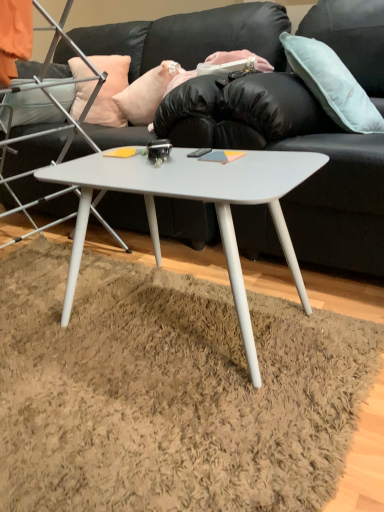
You are a GUI agent. You are given a task and a screenshot of the screen. Output one action in this format:
    pyautogui.click(x=<x>, y=<y>)
    Task: Click on the white matte chair at center
    The width and height of the screenshot is (384, 512).
    Given the screenshot: What is the action you would take?
    pyautogui.click(x=51, y=128)

What is the approximate width of white matte chair at center?

27.33 inches.

Describe the element at coordinates (264, 124) in the screenshot. The width and height of the screenshot is (384, 512). I see `black leather couch at center` at that location.

This screenshot has height=512, width=384. I want to click on pink fabric pillow at upper center, the second pillow when ordered from right to left, so click(146, 93).

In order to face peach fabric pillow at upper left, the 1th pillow in the left-to-right sequence, should I rotate leftwards or rightwards?

You should rotate left by 11.701 degrees.

The width and height of the screenshot is (384, 512). I want to click on peach fabric pillow at upper left, arranged as the third pillow when viewed from the right, so click(x=109, y=90).

This screenshot has width=384, height=512. Identify the location of white matte chair at center. (51, 128).

Can you confirm if black leather couch at center is taller than light blue fabric pillow at upper right, which is counted as the 3th pillow, starting from the left?

Indeed, black leather couch at center has a greater height compared to light blue fabric pillow at upper right, which is counted as the 3th pillow, starting from the left.

Find the location of a particular element. pillow that is the 3rd one above the black leather couch at center (from a real-world perspective) is located at coordinates (332, 84).

Does black leather couch at center touch light blue fabric pillow at upper right, the first pillow when ordered from right to left?

No, black leather couch at center is not next to light blue fabric pillow at upper right, the first pillow when ordered from right to left.

In the image, there is a pink fabric pillow at upper center, acting as the 2th pillow starting from the left. Where is `pillow above it (from the image's perspective)`? This screenshot has height=512, width=384. pillow above it (from the image's perspective) is located at coordinates (109, 90).

In the scene shown: Is peach fabric pillow at upper left, arranged as the third pillow when viewed from the right, further to camera compared to pink fabric pillow at upper center, the second pillow when ordered from right to left?

Yes, peach fabric pillow at upper left, arranged as the third pillow when viewed from the right, is further from the viewer.

Would you say pink fabric pillow at upper center, acting as the 2th pillow starting from the left, is part of peach fabric pillow at upper left, the 1th pillow in the left-to-right sequence,'s contents?

No, pink fabric pillow at upper center, acting as the 2th pillow starting from the left, is not a part of peach fabric pillow at upper left, the 1th pillow in the left-to-right sequence.

Is point (113, 82) positioned in front of point (165, 77)?

No, it is behind (165, 77).

What's the angular difference between peach fabric pillow at upper left, the 1th pillow in the left-to-right sequence, and white matte chair at center's facing directions?

The angle between the facing direction of peach fabric pillow at upper left, the 1th pillow in the left-to-right sequence, and the facing direction of white matte chair at center is 18.3 degrees.

From a real-world perspective, is peach fabric pillow at upper left, arranged as the third pillow when viewed from the right, under white matte chair at center?

No, from a real-world perspective, peach fabric pillow at upper left, arranged as the third pillow when viewed from the right, is not under white matte chair at center.

Considering the sizes of objects peach fabric pillow at upper left, arranged as the third pillow when viewed from the right, and white matte chair at center in the image provided, who is taller, peach fabric pillow at upper left, arranged as the third pillow when viewed from the right, or white matte chair at center?

white matte chair at center is taller.

Is peach fabric pillow at upper left, the 1th pillow in the left-to-right sequence, at the right side of white matte chair at center?

Yes, peach fabric pillow at upper left, the 1th pillow in the left-to-right sequence, is to the right of white matte chair at center.

Which object is thinner, white matte chair at center or peach fabric pillow at upper left, arranged as the third pillow when viewed from the right?

peach fabric pillow at upper left, arranged as the third pillow when viewed from the right.

Which object is positioned more to the right, white matte chair at center or peach fabric pillow at upper left, the 1th pillow in the left-to-right sequence?

From the viewer's perspective, peach fabric pillow at upper left, the 1th pillow in the left-to-right sequence, appears more on the right side.

From a real-world perspective, which object stands above the other?

peach fabric pillow at upper left, arranged as the third pillow when viewed from the right, from a real-world perspective.

What's the angular difference between white matte chair at center and peach fabric pillow at upper left, arranged as the third pillow when viewed from the right,'s facing directions?

white matte chair at center and peach fabric pillow at upper left, arranged as the third pillow when viewed from the right, are facing 18.3 degrees away from each other.

From a real-world perspective, is peach fabric pillow at upper left, arranged as the third pillow when viewed from the right, located higher than light blue fabric pillow at upper right, the first pillow when ordered from right to left?

No, from a real-world perspective, peach fabric pillow at upper left, arranged as the third pillow when viewed from the right, is not over light blue fabric pillow at upper right, the first pillow when ordered from right to left

Is point (71, 61) farther from camera compared to point (306, 61)?

That is True.

Could you tell me if peach fabric pillow at upper left, arranged as the third pillow when viewed from the right, is turned towards light blue fabric pillow at upper right, the first pillow when ordered from right to left?

No, peach fabric pillow at upper left, arranged as the third pillow when viewed from the right, is not turned towards light blue fabric pillow at upper right, the first pillow when ordered from right to left.

From the image's perspective, who appears lower, white matte coffee table at center or light blue fabric pillow at upper right, which is counted as the 3th pillow, starting from the left?

From the image's view, white matte coffee table at center is below.

Based on the photo, which object is positioned more to the left, white matte coffee table at center or light blue fabric pillow at upper right, which is counted as the 3th pillow, starting from the left?

white matte coffee table at center.

Does white matte coffee table at center have a larger size compared to light blue fabric pillow at upper right, which is counted as the 3th pillow, starting from the left?

Indeed, white matte coffee table at center has a larger size compared to light blue fabric pillow at upper right, which is counted as the 3th pillow, starting from the left.

From the image's perspective, count 1st pillows upward from the white matte coffee table at center and point to it. Please provide its 2D coordinates.

[(332, 84)]

Is white matte chair at center oriented towards white matte coffee table at center?

No.

Who is bigger, white matte chair at center or white matte coffee table at center?

Bigger between the two is white matte chair at center.

From the image's perspective, which object appears higher, white matte chair at center or white matte coffee table at center?

white matte chair at center is shown above in the image.

From a real-world perspective, does white matte chair at center sit lower than white matte coffee table at center?

Actually, white matte chair at center is physically above white matte coffee table at center in the real world.

This screenshot has width=384, height=512. I want to click on studio couch above the light blue fabric pillow at upper right, which is counted as the 3th pillow, starting from the left (from the image's perspective), so click(x=264, y=124).

From the peach fabric pillow at upper left, arranged as the third pillow when viewed from the right, count 1st pillows forward and point to it. Please provide its 2D coordinates.

[(146, 93)]

From the image, which object appears to be nearer to pink fabric pillow at upper center, acting as the 2th pillow starting from the left, white matte chair at center or light blue fabric pillow at upper right, the first pillow when ordered from right to left?

white matte chair at center is closer to pink fabric pillow at upper center, acting as the 2th pillow starting from the left.

Based on the photo, when comparing their distances from pink fabric pillow at upper center, acting as the 2th pillow starting from the left, does light blue fabric pillow at upper right, which is counted as the 3th pillow, starting from the left, or black leather couch at center seem further?

Among the two, light blue fabric pillow at upper right, which is counted as the 3th pillow, starting from the left, is located further to pink fabric pillow at upper center, acting as the 2th pillow starting from the left.

From the image, which object appears to be farther from black leather couch at center, light blue fabric pillow at upper right, the first pillow when ordered from right to left, or peach fabric pillow at upper left, arranged as the third pillow when viewed from the right?

peach fabric pillow at upper left, arranged as the third pillow when viewed from the right, is further to black leather couch at center.

Estimate the real-world distances between objects in this image. Which object is closer to white matte coffee table at center, white matte chair at center or black leather couch at center?

black leather couch at center.

Estimate the real-world distances between objects in this image. Which object is closer to pink fabric pillow at upper center, acting as the 2th pillow starting from the left, peach fabric pillow at upper left, the 1th pillow in the left-to-right sequence, or light blue fabric pillow at upper right, which is counted as the 3th pillow, starting from the left?

Based on the image, peach fabric pillow at upper left, the 1th pillow in the left-to-right sequence, appears to be nearer to pink fabric pillow at upper center, acting as the 2th pillow starting from the left.

Considering their positions, is black leather couch at center positioned further to peach fabric pillow at upper left, the 1th pillow in the left-to-right sequence, than light blue fabric pillow at upper right, the first pillow when ordered from right to left?

light blue fabric pillow at upper right, the first pillow when ordered from right to left, lies further to peach fabric pillow at upper left, the 1th pillow in the left-to-right sequence, than the other object.

Based on their spatial positions, is peach fabric pillow at upper left, arranged as the third pillow when viewed from the right, or light blue fabric pillow at upper right, which is counted as the 3th pillow, starting from the left, further from white matte chair at center?

light blue fabric pillow at upper right, which is counted as the 3th pillow, starting from the left, is further to white matte chair at center.

Looking at the image, which one is located further to light blue fabric pillow at upper right, which is counted as the 3th pillow, starting from the left, white matte coffee table at center or pink fabric pillow at upper center, the second pillow when ordered from right to left?

The object further to light blue fabric pillow at upper right, which is counted as the 3th pillow, starting from the left, is pink fabric pillow at upper center, the second pillow when ordered from right to left.

The image size is (384, 512). Find the location of `pillow between black leather couch at center and light blue fabric pillow at upper right, which is counted as the 3th pillow, starting from the left`. pillow between black leather couch at center and light blue fabric pillow at upper right, which is counted as the 3th pillow, starting from the left is located at coordinates (146, 93).

Where is `studio couch located between peach fabric pillow at upper left, arranged as the third pillow when viewed from the right, and light blue fabric pillow at upper right, the first pillow when ordered from right to left, in the left-right direction`? The height and width of the screenshot is (512, 384). studio couch located between peach fabric pillow at upper left, arranged as the third pillow when viewed from the right, and light blue fabric pillow at upper right, the first pillow when ordered from right to left, in the left-right direction is located at coordinates pos(264,124).

The height and width of the screenshot is (512, 384). In order to click on pillow positioned between white matte coffee table at center and pink fabric pillow at upper center, the second pillow when ordered from right to left, from near to far in this screenshot , I will do `click(332, 84)`.

Find the location of `pillow located between black leather couch at center and peach fabric pillow at upper left, the 1th pillow in the left-to-right sequence, in the depth direction`. pillow located between black leather couch at center and peach fabric pillow at upper left, the 1th pillow in the left-to-right sequence, in the depth direction is located at coordinates (146, 93).